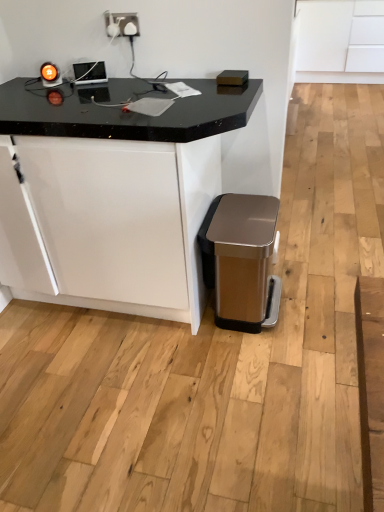
Question: Is satin gold plastic trash can at lower right wider or thinner than satin white socket at upper center?

Choices:
 (A) wide
 (B) thin

Answer: (A)

Question: Would you say satin gold plastic trash can at lower right is inside or outside satin white socket at upper center?

Choices:
 (A) outside
 (B) inside

Answer: (A)

Question: Which is nearer to the satin gold plastic trash can at lower right?

Choices:
 (A) black marble table at center
 (B) satin white socket at upper center
 (C) white matte cabinet at upper right

Answer: (A)

Question: Considering the real-world distances, which object is farthest from the black marble table at center?

Choices:
 (A) satin gold plastic trash can at lower right
 (B) satin white socket at upper center
 (C) white matte cabinet at upper right

Answer: (C)